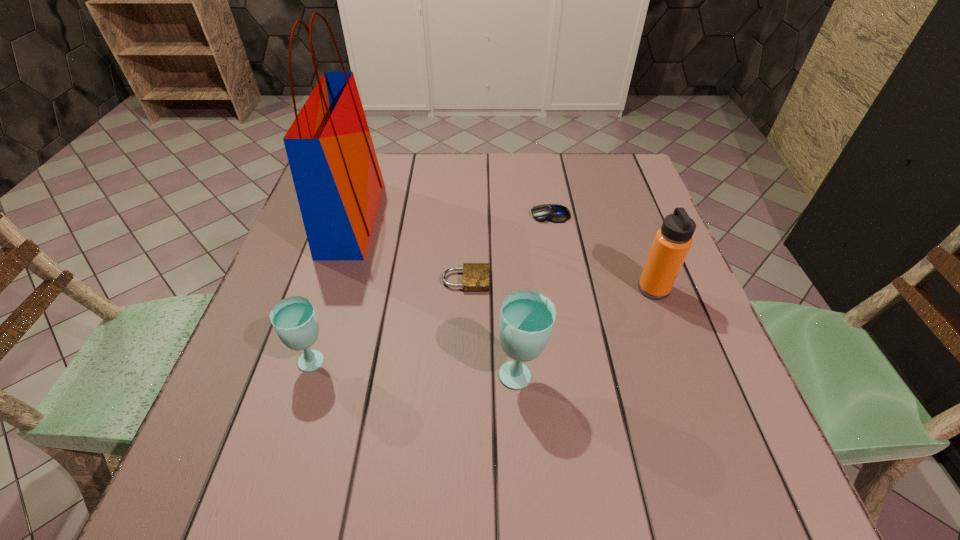
Where is `the fourth tallest object`? The height and width of the screenshot is (540, 960). the fourth tallest object is located at coordinates (294, 320).

Where is `the left glass`? The width and height of the screenshot is (960, 540). the left glass is located at coordinates (294, 320).

Where is `the third object from right to left`? the third object from right to left is located at coordinates (527, 317).

You are a GUI agent. You are given a task and a screenshot of the screen. Output one action in this format:
    pyautogui.click(x=<x>, y=<y>)
    Task: Click on the taller glass
    Image resolution: width=960 pixels, height=540 pixels.
    Given the screenshot: What is the action you would take?
    pyautogui.click(x=527, y=317)

Where is `the tallest object`? This screenshot has width=960, height=540. the tallest object is located at coordinates (336, 174).

The image size is (960, 540). In order to click on computer mouse in this screenshot , I will do 555,213.

In order to click on the second shortest object in this screenshot , I will do `click(555, 213)`.

The width and height of the screenshot is (960, 540). What are the coordinates of `the shortest object` in the screenshot? It's located at (475, 275).

You are a GUI agent. You are given a task and a screenshot of the screen. Output one action in this format:
    pyautogui.click(x=<x>, y=<y>)
    Task: Click on the padlock
    This screenshot has height=540, width=960.
    Given the screenshot: What is the action you would take?
    pyautogui.click(x=475, y=275)

Identify the location of the rightmost object. (672, 242).